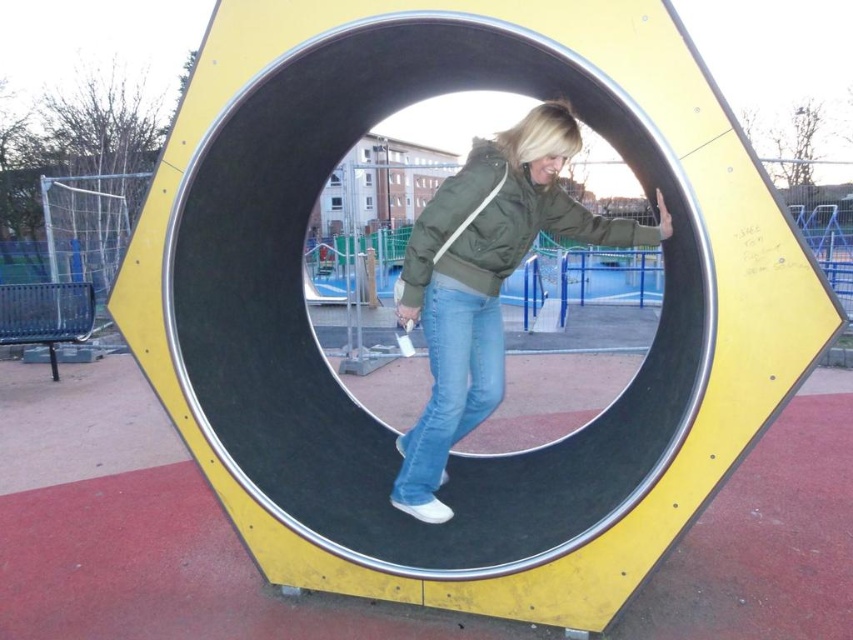
You are a photographer trying to capture the person in the matte green jacket at center and the green matte jacket at center in the same frame. However, you notice something odd about their sizes. What do you observe about the relationship between the two jackets?

The matte green jacket at center is much taller than the green matte jacket at center, so the photographer would notice that one jacket appears significantly larger in size compared to the other.

You are designing a new playground and need to ensure that the safety distance between two equipment pieces is sufficient. You observe the matte green jacket at center and the green matte jacket at center in the image. Which of these two jackets has a greater width, and why is this important for determining safety distances?

The matte green jacket at center has a greater width than the green matte jacket at center. This is important because understanding the dimensions of objects like jackets can help in calculating appropriate safety distances between playground equipment to accommodate individuals wearing such garments comfortably without overcrowding.

In the scene shown: You are a photographer standing at the edge of the playground. You want to take a photo of the person wearing the matte green jacket at center. Your camera has a maximum focus range of 8 feet. Can you capture the person clearly with your camera?

The matte green jacket at center and camera are 8.09 feet apart, which is slightly beyond the camera maximum focus range of 8 feet. Therefore, the photographer cannot capture the person clearly with the camera.